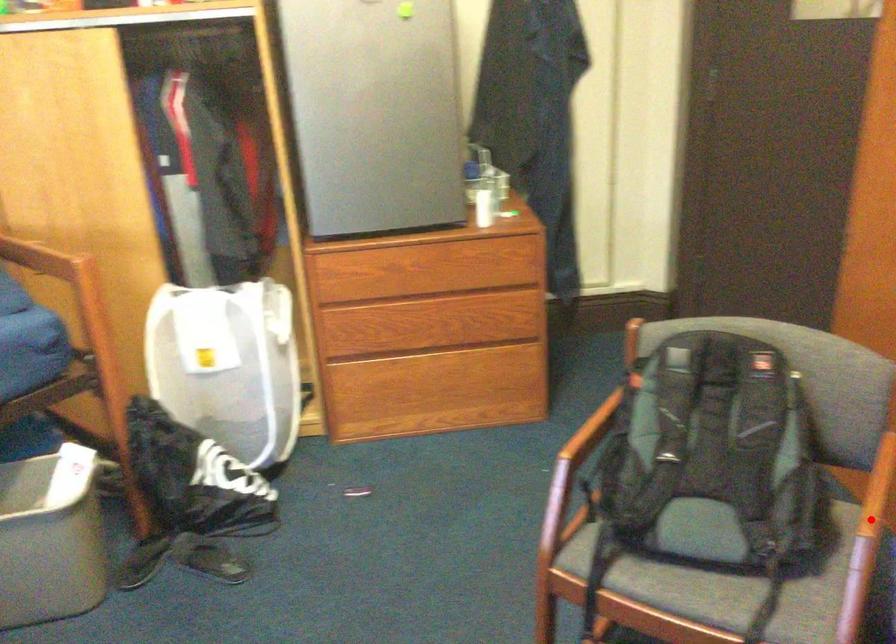
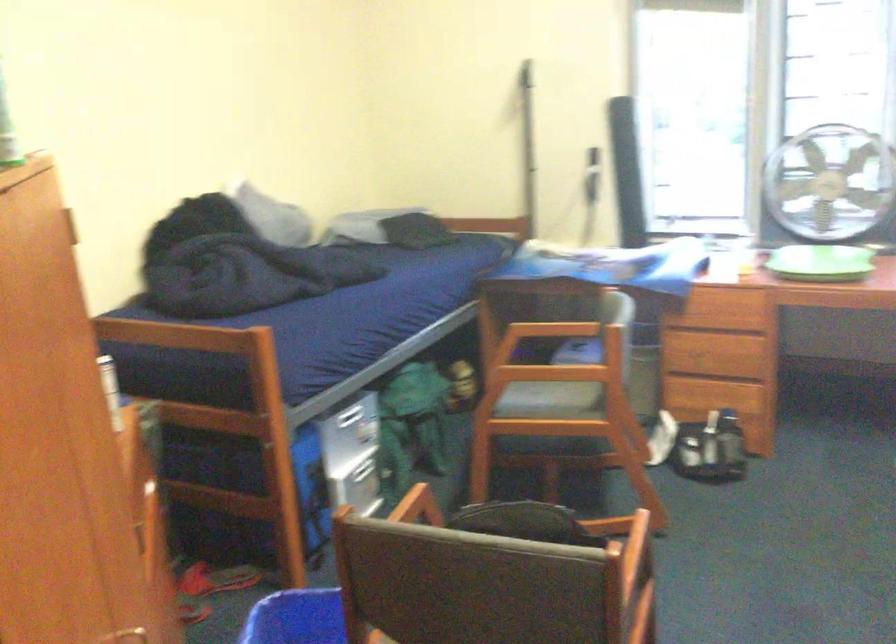
Question: I am providing you with two images of the same scene from different viewpoints. A red point is marked on the first image. Can you still see the location of the red point in image 2?

Choices:
 (A) Yes
 (B) No

Answer: (B)